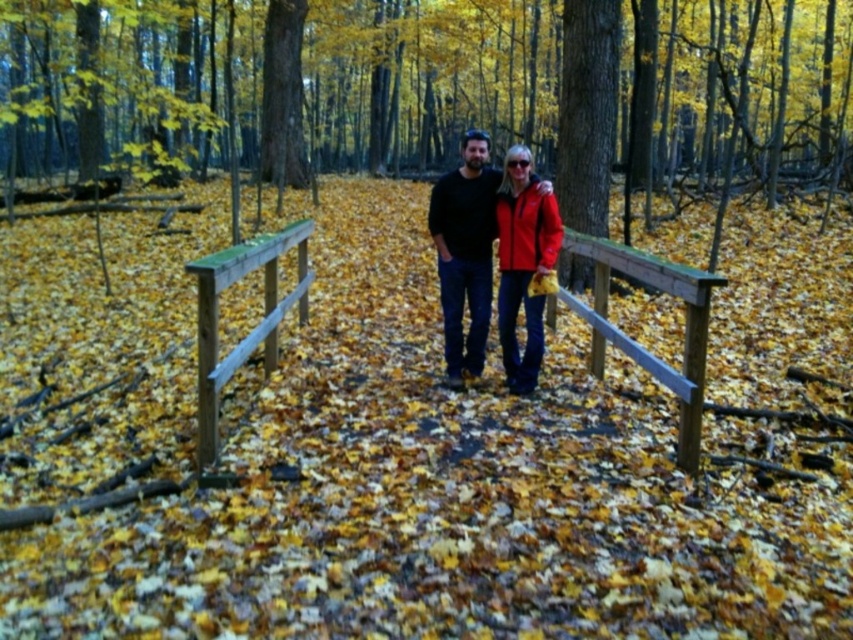
Is wooden rail at center behind matte red jacket at center?

No.

Is wooden rail at center bigger than matte red jacket at center?

Correct, wooden rail at center is larger in size than matte red jacket at center.

Is point (560, 296) behind point (508, 172)?

Yes, it is behind point (508, 172).

This screenshot has height=640, width=853. Find the location of `wooden rail at center`. wooden rail at center is located at coordinates (633, 339).

Is wooden rail at center closer to camera compared to green wooden rail at center?

→ No.

Consider the image. Is wooden rail at center wider than green wooden rail at center?

Correct, the width of wooden rail at center exceeds that of green wooden rail at center.

Is point (640, 253) positioned behind point (201, 403)?

Yes.

Where is `wooden rail at center`? The height and width of the screenshot is (640, 853). wooden rail at center is located at coordinates (633, 339).

Which is more to the right, matte black shirt at center or matte red jacket at center?

From the viewer's perspective, matte red jacket at center appears more on the right side.

Is point (476, 296) farther from camera compared to point (509, 324)?

Yes, point (476, 296) is farther from viewer.

This screenshot has width=853, height=640. What are the coordinates of `matte black shirt at center` in the screenshot? It's located at (465, 252).